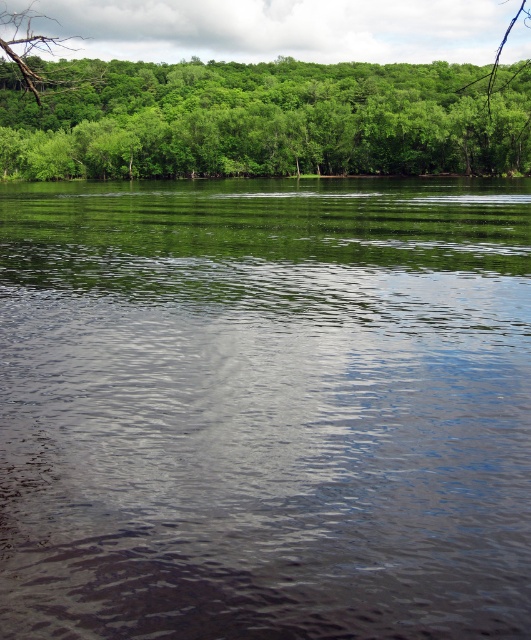
Between clear water at center and brown rough tree branch at upper left, which one has more height?

Standing taller between the two is brown rough tree branch at upper left.

Does point (486, 289) come behind point (13, 36)?

That is False.

This screenshot has width=531, height=640. Find the location of `clear water at center`. clear water at center is located at coordinates (264, 408).

In the scene shown: Does clear water at center have a greater width compared to green leafy tree at upper center?

Incorrect, clear water at center's width does not surpass green leafy tree at upper center's.

Is point (292, 305) more distant than point (108, 99)?

No.

Find the location of a particular element. This screenshot has height=640, width=531. clear water at center is located at coordinates (264, 408).

Can you confirm if green leafy tree at upper center is bigger than brown rough tree branch at upper left?

Incorrect, green leafy tree at upper center is not larger than brown rough tree branch at upper left.

Is the position of green leafy tree at upper center more distant than that of brown rough tree branch at upper left?

Yes.

Measure the distance between point (455, 129) and camera.

Point (455, 129) is 156.02 meters away from camera.

Where is `green leafy tree at upper center`? green leafy tree at upper center is located at coordinates (263, 120).